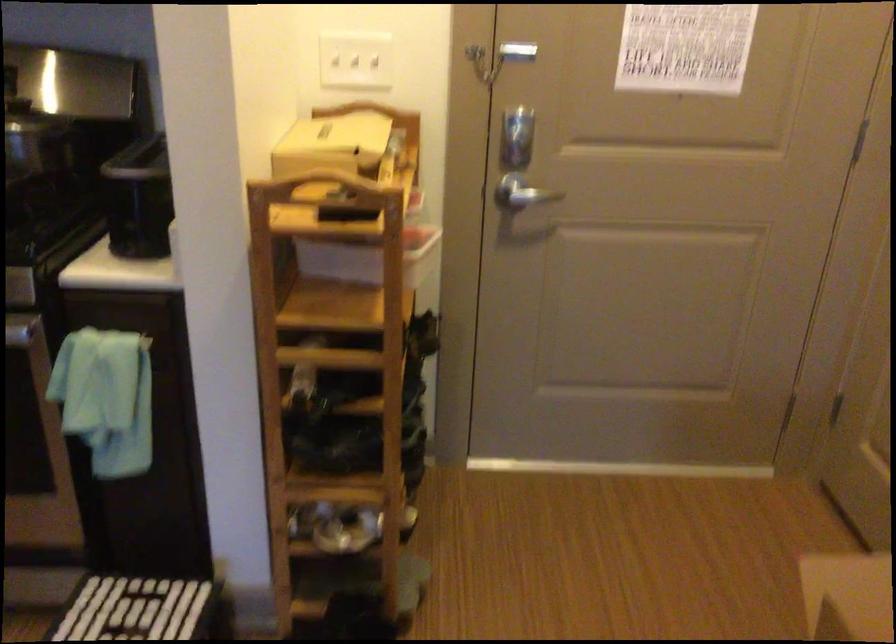
Where is `box lid handle`? This screenshot has height=644, width=896. box lid handle is located at coordinates (331, 144).